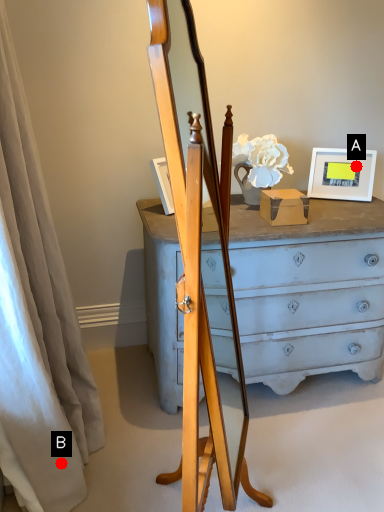
Question: Two points are circled on the image, labeled by A and B beside each circle. Which point is further to the camera?

Choices:
 (A) A is further
 (B) B is further

Answer: (A)